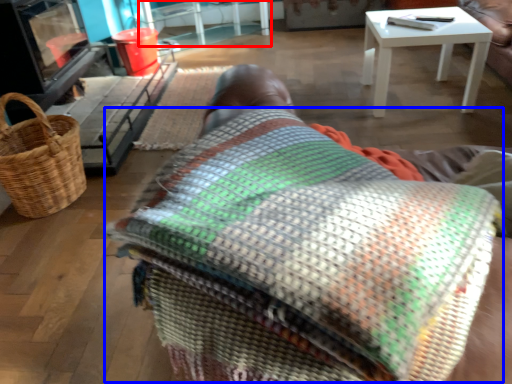
Question: Among these objects, which one is farthest to the camera, table (highlighted by a red box) or blanket (highlighted by a blue box)?

Choices:
 (A) table
 (B) blanket

Answer: (A)